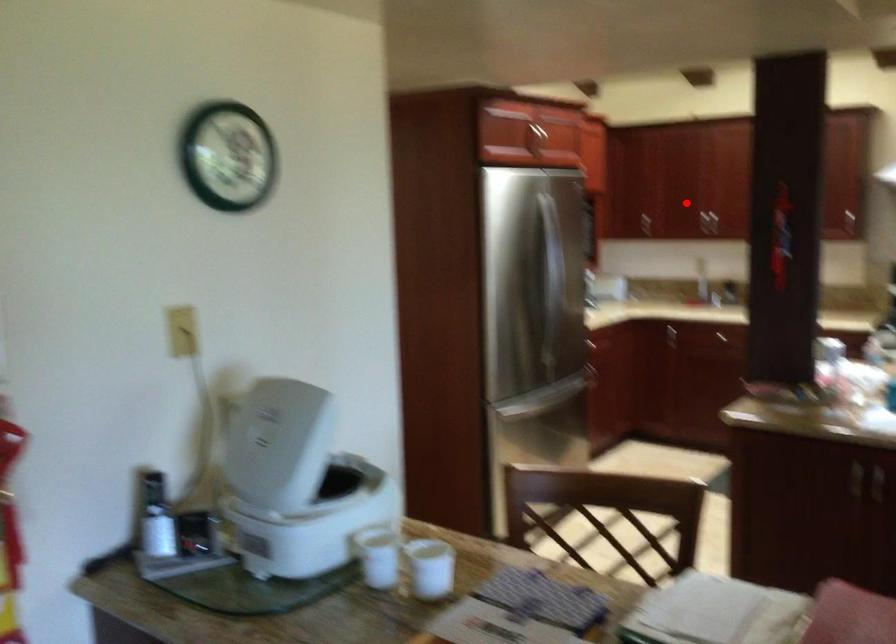
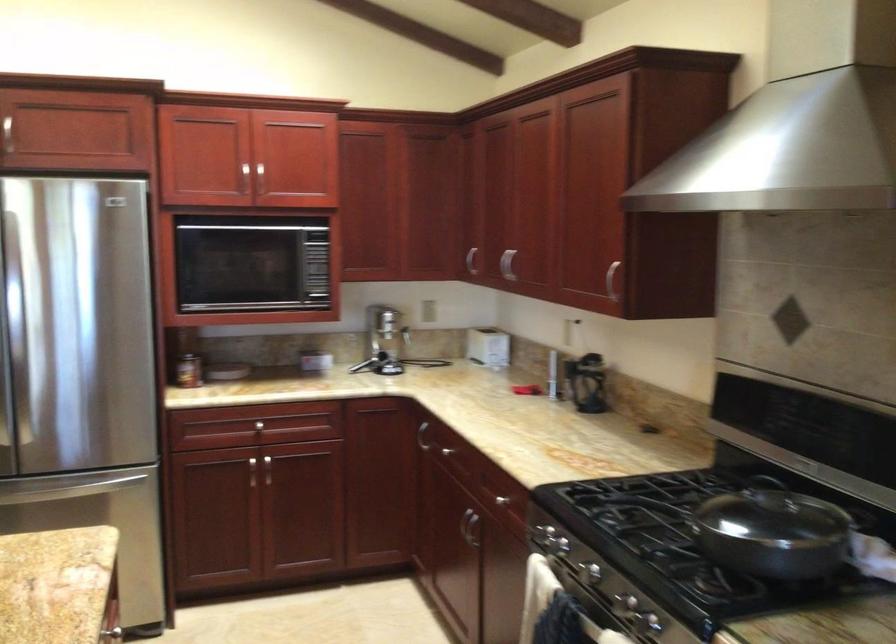
Question: I am providing you with two images of the same scene from different viewpoints. Given a red point in image1, look at the same physical point in image2. Is it:

Choices:
 (A) Closer to the viewpoint
 (B) Farther from the viewpoint

Answer: (A)